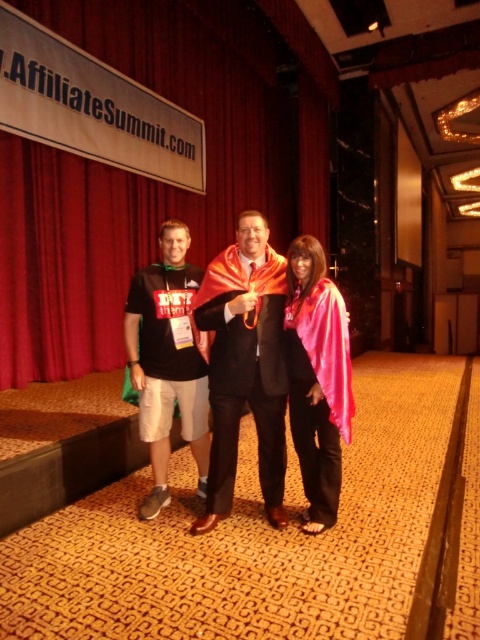
Question: Which object is closer to the camera taking this photo?

Choices:
 (A) pink satin cape at center
 (B) red velvet curtain at upper center

Answer: (A)

Question: In this image, where is red velvet curtain at upper center located relative to shiny orange cape at center?

Choices:
 (A) below
 (B) above

Answer: (B)

Question: Does red velvet curtain at upper center have a lesser width compared to matte black t-shirt at center?

Choices:
 (A) no
 (B) yes

Answer: (B)

Question: Does shiny orange cape at center lie behind matte black t-shirt at center?

Choices:
 (A) yes
 (B) no

Answer: (B)

Question: Which point is farther to the camera?

Choices:
 (A) red velvet curtain at upper center
 (B) shiny orange cape at center

Answer: (A)

Question: Which object is the farthest from the shiny orange cape at center?

Choices:
 (A) pink satin cape at center
 (B) red velvet curtain at upper center
 (C) matte black t-shirt at center

Answer: (B)